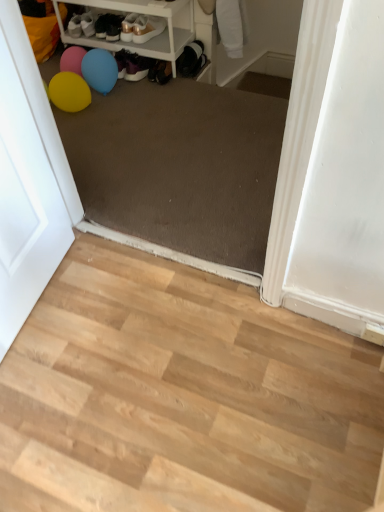
Question: Can we say white plastic shelf at upper left lies outside light wood floor at lower left?

Choices:
 (A) yes
 (B) no

Answer: (A)

Question: Is white plastic shelf at upper left closer to camera compared to light wood floor at lower left?

Choices:
 (A) no
 (B) yes

Answer: (A)

Question: Can you confirm if white plastic shelf at upper left is taller than light wood floor at lower left?

Choices:
 (A) yes
 (B) no

Answer: (A)

Question: Is white plastic shelf at upper left aimed at light wood floor at lower left?

Choices:
 (A) no
 (B) yes

Answer: (B)

Question: From a real-world perspective, is white plastic shelf at upper left on top of light wood floor at lower left?

Choices:
 (A) no
 (B) yes

Answer: (B)

Question: Considering the positions of point [x=107, y=22] and point [x=119, y=292], is point [x=107, y=22] closer or farther from the camera than point [x=119, y=292]?

Choices:
 (A) farther
 (B) closer

Answer: (A)

Question: Relative to light wood floor at lower left, is matte black shoes at upper center, the 3th footwear positioned from the right, in front or behind?

Choices:
 (A) front
 (B) behind

Answer: (B)

Question: Is matte black shoes at upper center, the 3th footwear positioned from the right, bigger or smaller than light wood floor at lower left?

Choices:
 (A) big
 (B) small

Answer: (B)

Question: Considering the positions of matte black shoes at upper center, which ranks as the 1th footwear in left-to-right order, and light wood floor at lower left in the image, is matte black shoes at upper center, which ranks as the 1th footwear in left-to-right order, taller or shorter than light wood floor at lower left?

Choices:
 (A) short
 (B) tall

Answer: (B)

Question: From their relative heights in the image, would you say pink rubber balloon at upper left is taller or shorter than matte black shoes at upper center, which ranks as the 1th footwear in left-to-right order?

Choices:
 (A) tall
 (B) short

Answer: (A)

Question: Would you say pink rubber balloon at upper left is inside or outside matte black shoes at upper center, which ranks as the 1th footwear in left-to-right order?

Choices:
 (A) outside
 (B) inside

Answer: (A)

Question: Is pink rubber balloon at upper left wider or thinner than matte black shoes at upper center, the 3th footwear positioned from the right?

Choices:
 (A) thin
 (B) wide

Answer: (A)

Question: Is pink rubber balloon at upper left bigger or smaller than matte black shoes at upper center, which ranks as the 1th footwear in left-to-right order?

Choices:
 (A) small
 (B) big

Answer: (B)

Question: Looking at the image, does matte white screen door at left seem bigger or smaller compared to shiny gold shoe at upper center, acting as the 2th footwear starting from the left?

Choices:
 (A) small
 (B) big

Answer: (B)

Question: From the image's perspective, is matte white screen door at left above or below shiny gold shoe at upper center, which ranks as the 2th footwear in right-to-left order?

Choices:
 (A) above
 (B) below

Answer: (B)